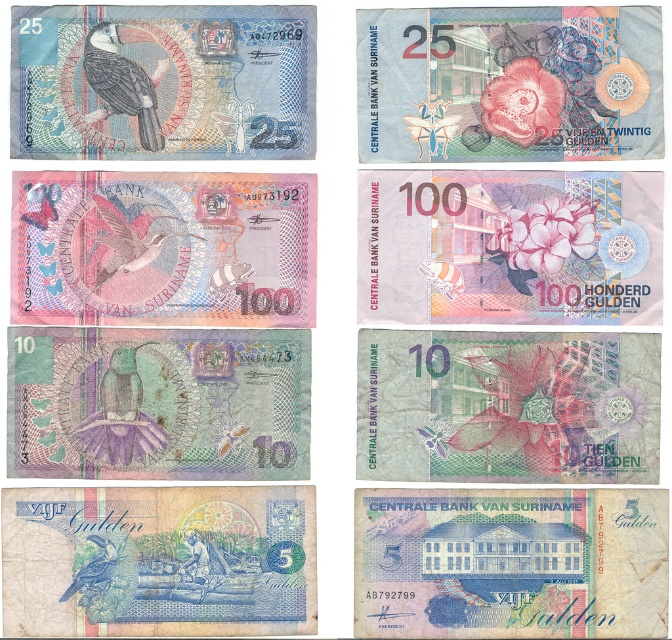
Consider the image. Is pink paper money at center to the right of blue paper currency at bottom right from the viewer's perspective?

Indeed, pink paper money at center is positioned on the right side of blue paper currency at bottom right.

Between pink paper money at center and blue paper currency at bottom right, which one has less height?

blue paper currency at bottom right is shorter.

The width and height of the screenshot is (672, 640). In order to click on pink paper money at center in this screenshot , I will do `click(509, 246)`.

Is pink paper money at center bigger than matte black toucan at upper left?

Yes.

Between point (640, 196) and point (153, 132), which one is positioned in front?

Point (153, 132) is in front.

The height and width of the screenshot is (640, 672). Describe the element at coordinates (509, 246) in the screenshot. I see `pink paper money at center` at that location.

Where is `pink paper money at center`? The width and height of the screenshot is (672, 640). pink paper money at center is located at coordinates (509, 246).

Looking at this image, which of these two, blue paper currency at bottom right or shiny pink hummingbird at center, stands taller?

blue paper currency at bottom right is taller.

Does point (632, 582) lie in front of point (144, 248)?

Yes, point (632, 582) is in front of point (144, 248).

The image size is (672, 640). Identify the location of blue paper currency at bottom right. (509, 563).